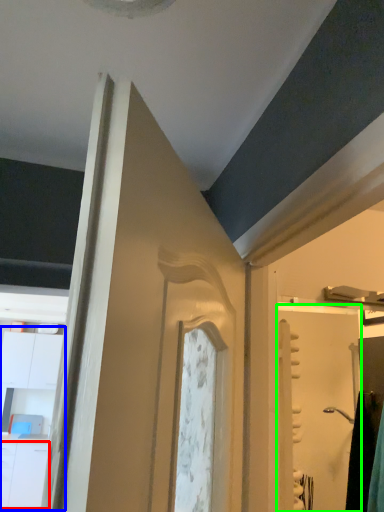
Question: Which is nearer to the drawer (highlighted by a red box)? dresser (highlighted by a blue box) or screen door (highlighted by a green box).

Choices:
 (A) dresser
 (B) screen door

Answer: (A)